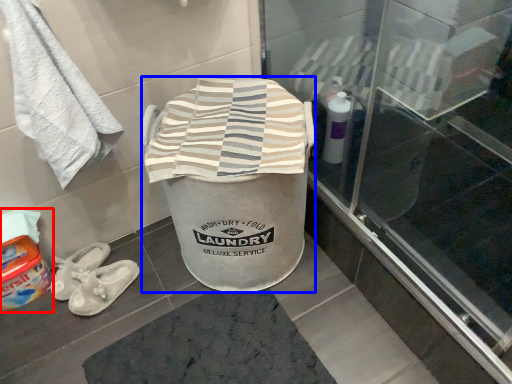
Question: Which object appears closest to the camera in this image, wash (highlighted by a red box) or writing (highlighted by a blue box)?

Choices:
 (A) wash
 (B) writing

Answer: (B)